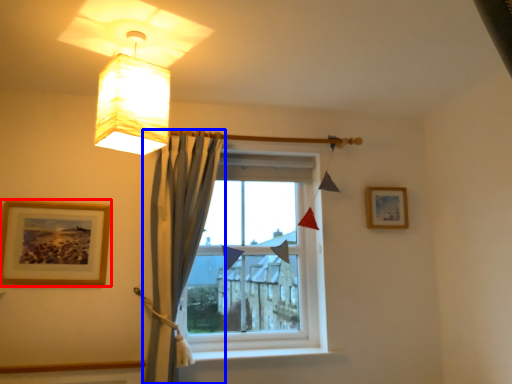
Question: Which object is closer to the camera taking this photo, picture frame (highlighted by a red box) or curtain (highlighted by a blue box)?

Choices:
 (A) picture frame
 (B) curtain

Answer: (B)